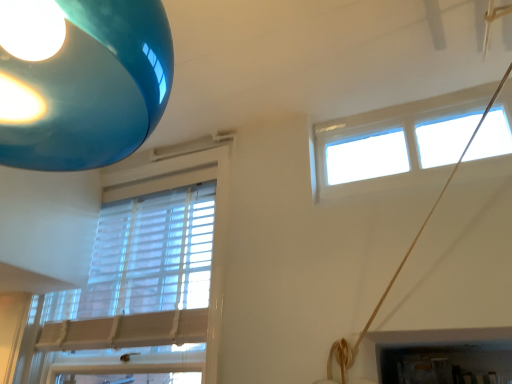
Question: Does white textured blinds at left, arranged as the second window when viewed from the right, come behind white plastic window at upper right, marked as the second window in a left-to-right arrangement?

Choices:
 (A) yes
 (B) no

Answer: (A)

Question: Is white plastic window at upper right, marked as the second window in a left-to-right arrangement, at the back of white textured blinds at left, arranged as the second window when viewed from the right?

Choices:
 (A) yes
 (B) no

Answer: (B)

Question: Is white textured blinds at left, arranged as the second window when viewed from the right, positioned far away from white plastic window at upper right, the first window in the right-to-left sequence?

Choices:
 (A) no
 (B) yes

Answer: (A)

Question: Can you confirm if white textured blinds at left, arranged as the second window when viewed from the right, is positioned to the right of white plastic window at upper right, the first window in the right-to-left sequence?

Choices:
 (A) yes
 (B) no

Answer: (B)

Question: Can you confirm if white textured blinds at left, arranged as the second window when viewed from the right, is wider than white plastic window at upper right, marked as the second window in a left-to-right arrangement?

Choices:
 (A) no
 (B) yes

Answer: (B)

Question: Is white textured blinds at left, arranged as the second window when viewed from the right, completely or partially outside of white plastic window at upper right, marked as the second window in a left-to-right arrangement?

Choices:
 (A) yes
 (B) no

Answer: (A)

Question: Is white plastic window at upper right, marked as the second window in a left-to-right arrangement, to the left of white textured blinds at left, arranged as the second window when viewed from the right, from the viewer's perspective?

Choices:
 (A) yes
 (B) no

Answer: (B)

Question: Is white plastic window at upper right, marked as the second window in a left-to-right arrangement, completely or partially outside of white textured blinds at left, arranged as the second window when viewed from the right?

Choices:
 (A) yes
 (B) no

Answer: (A)

Question: Is white plastic window at upper right, the first window in the right-to-left sequence, not close to white textured blinds at left, the 1th window from the left?

Choices:
 (A) no
 (B) yes

Answer: (A)

Question: Does white plastic window at upper right, the first window in the right-to-left sequence, appear on the right side of white textured blinds at left, arranged as the second window when viewed from the right?

Choices:
 (A) yes
 (B) no

Answer: (A)

Question: Is white plastic window at upper right, marked as the second window in a left-to-right arrangement, taller than white textured blinds at left, arranged as the second window when viewed from the right?

Choices:
 (A) yes
 (B) no

Answer: (B)

Question: Does white plastic window at upper right, marked as the second window in a left-to-right arrangement, lie in front of white textured blinds at left, arranged as the second window when viewed from the right?

Choices:
 (A) no
 (B) yes

Answer: (B)

Question: Does point (210, 357) appear closer or farther from the camera than point (498, 155)?

Choices:
 (A) farther
 (B) closer

Answer: (B)